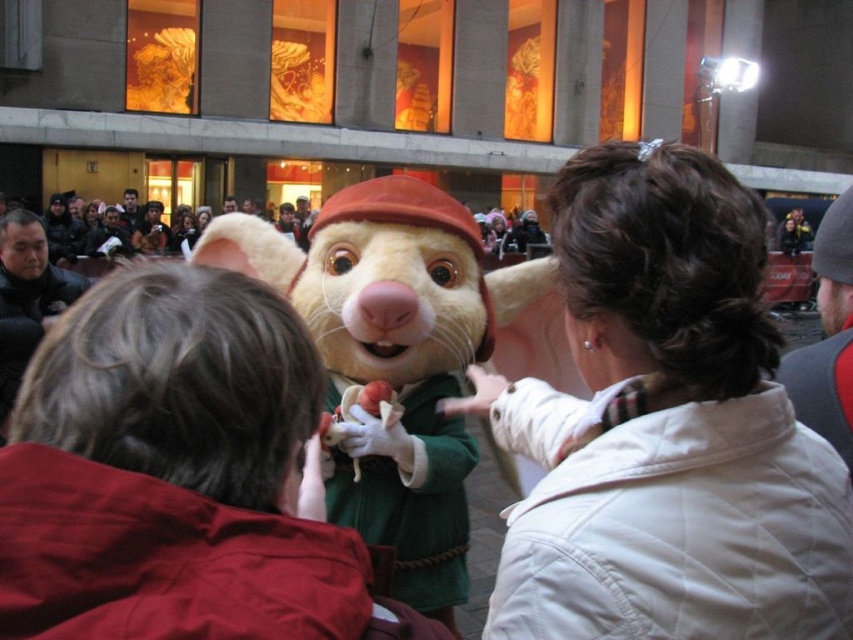
You are standing at the point marked as point (665,428). What object is located exactly at that point?

The white quilted jacket at center is located exactly at point (665,428).

You are standing behind the white quilted jacket at center and want to see the fluffy beige costume at center. Can you see it without moving your position?

The white quilted jacket at center is in front of the fluffy beige costume at center, so you cannot see the fluffy beige costume at center from your current position.

You are a photographer trying to capture a photo of the fluffy beige costume at center and the white quilted jacket at center. Which one should you focus on first if you want to ensure both are in frame without moving the camera?

The white quilted jacket at center is taller than the fluffy beige costume at center, so you should focus on the white quilted jacket at center first to ensure it fits within the frame.